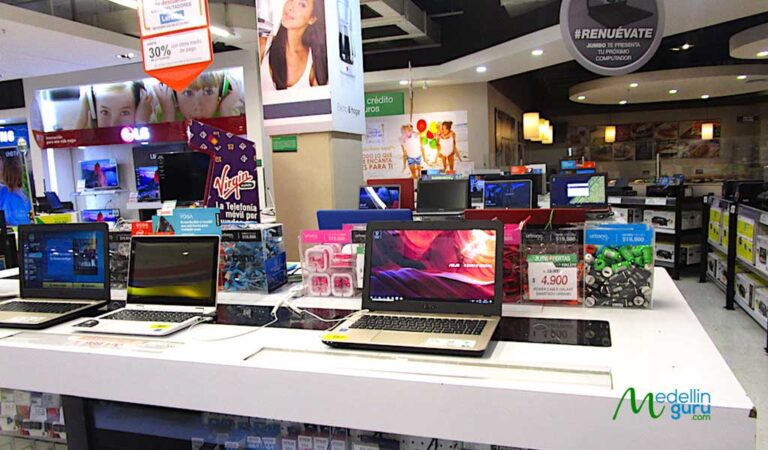
You are a GUI agent. You are given a task and a screenshot of the screen. Output one action in this format:
    pyautogui.click(x=<x>, y=<y>)
    Task: Click on the laptop
    The width and height of the screenshot is (768, 450).
    Given the screenshot: What is the action you would take?
    (x=515, y=212)